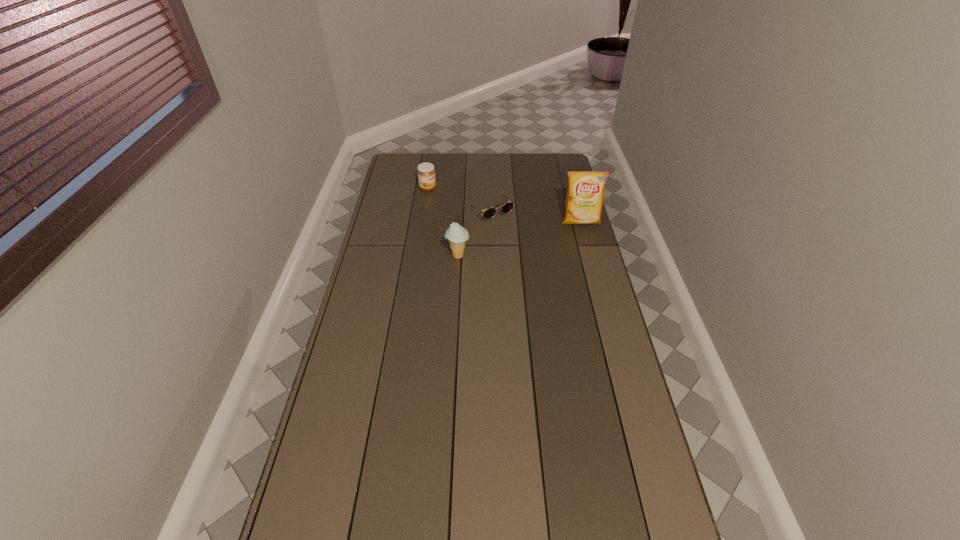
Find the location of `free region located 0.300m on the front label of the farthest object`. free region located 0.300m on the front label of the farthest object is located at coordinates (483, 215).

The height and width of the screenshot is (540, 960). Identify the location of vacant space located 0.360m on the front label of the farthest object. (493, 220).

This screenshot has width=960, height=540. In order to click on free space located on the front lenses of the sunglasses in this screenshot , I will do [x=518, y=242].

Identify the location of free location located on the front lenses of the sunglasses. Image resolution: width=960 pixels, height=540 pixels. (547, 273).

This screenshot has height=540, width=960. I want to click on blank area located 0.350m on the front lenses of the sunglasses, so click(547, 273).

At what (x,y) coordinates should I click in order to perform the action: click on object at the left edge. Please return your answer as a coordinate pair (x, y). This screenshot has height=540, width=960. Looking at the image, I should click on (426, 173).

Find the location of a particular element. The width and height of the screenshot is (960, 540). object that is at the right edge is located at coordinates (585, 194).

I want to click on free point at the far edge, so click(492, 173).

You are a GUI agent. You are given a task and a screenshot of the screen. Output one action in this format:
    pyautogui.click(x=<x>, y=<y>)
    Task: Click on the free location at the left edge
    This screenshot has width=960, height=540.
    Given the screenshot: What is the action you would take?
    pyautogui.click(x=349, y=467)

Locate an element on the screen. The height and width of the screenshot is (540, 960). free point at the right edge is located at coordinates (574, 233).